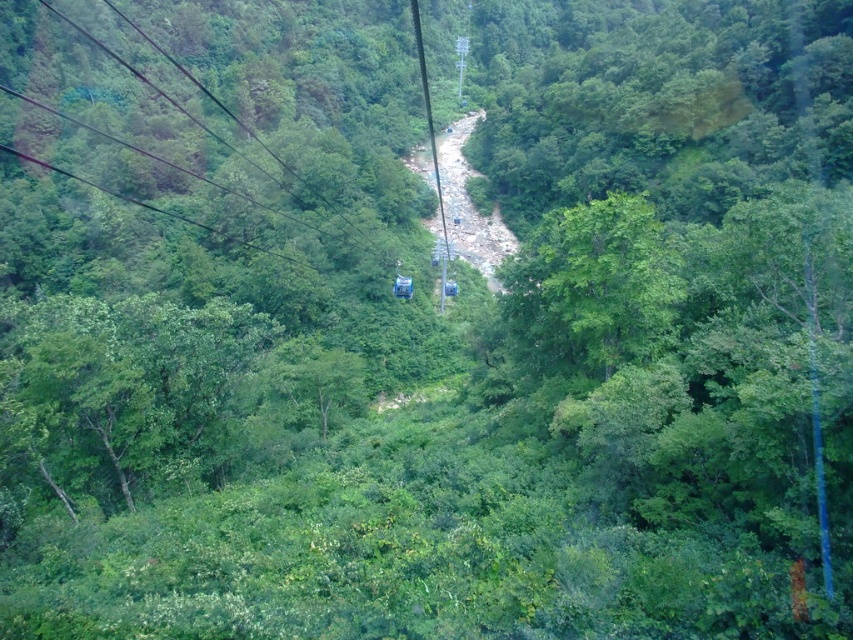
Based on the photo, you are a passenger in a cable car observing the green leafy tree at center and the metallic wire at center. Which object is closer to you?

The green leafy tree at center is closer to you because it is positioned under the metallic wire at center.

You are a passenger in the cable car and you see two points in the scene. The first point is at coordinate point (637, 218) and the second is at point (415, 10). Which point is nearer to you?

Point (637, 218) is closer to the viewer than point (415, 10).